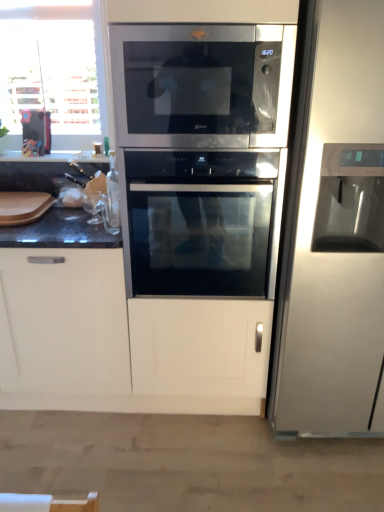
Question: Considering the relative sizes of satin black oven at center and satin silver refrigerator at right in the image provided, is satin black oven at center thinner than satin silver refrigerator at right?

Choices:
 (A) yes
 (B) no

Answer: (A)

Question: Can you confirm if satin black oven at center is smaller than satin silver refrigerator at right?

Choices:
 (A) no
 (B) yes

Answer: (B)

Question: From the image's perspective, is satin black oven at center above satin silver refrigerator at right?

Choices:
 (A) no
 (B) yes

Answer: (A)

Question: Is satin black oven at center closer to camera compared to satin silver refrigerator at right?

Choices:
 (A) yes
 (B) no

Answer: (B)

Question: From the image's perspective, is satin black oven at center located beneath satin silver refrigerator at right?

Choices:
 (A) no
 (B) yes

Answer: (B)

Question: Is satin black oven at center further to camera compared to satin silver refrigerator at right?

Choices:
 (A) yes
 (B) no

Answer: (A)

Question: Does satin black oven at center turn towards stainless steel microwave at center?

Choices:
 (A) yes
 (B) no

Answer: (B)

Question: Is satin black oven at center not inside stainless steel microwave at center?

Choices:
 (A) yes
 (B) no

Answer: (A)

Question: Does satin black oven at center lie behind stainless steel microwave at center?

Choices:
 (A) no
 (B) yes

Answer: (B)

Question: Is satin black oven at center positioned with its back to stainless steel microwave at center?

Choices:
 (A) no
 (B) yes

Answer: (A)

Question: From a real-world perspective, is satin black oven at center physically below stainless steel microwave at center?

Choices:
 (A) no
 (B) yes

Answer: (B)

Question: Considering the relative positions of satin black oven at center and stainless steel microwave at center in the image provided, is satin black oven at center in front of stainless steel microwave at center?

Choices:
 (A) no
 (B) yes

Answer: (A)

Question: Is satin silver refrigerator at right completely or partially outside of stainless steel microwave at center?

Choices:
 (A) yes
 (B) no

Answer: (A)